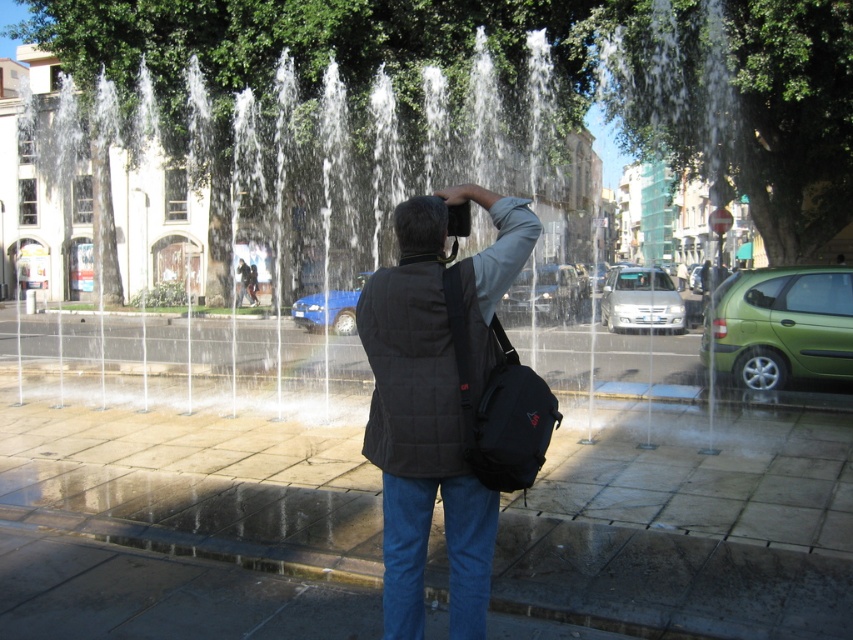
You are a photographer positioned at the center of the plaza, aiming to capture the fountain and the person taking a photo. Where should you position your camera to ensure both the fountain and the person in the dark gray quilted vest at center are in frame?

The dark gray quilted vest at center is located at point (434, 403). To include both the fountain and the person in the frame, position your camera centrally so that the fountain is at the focal point and the person remains within the frame at their coordinates.